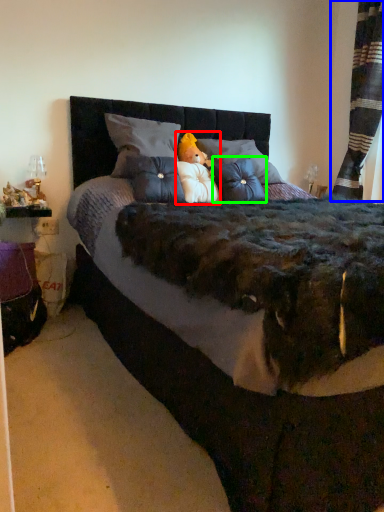
Question: Which object is the closest to the toy (highlighted by a red box)? Choose among these: curtain (highlighted by a blue box) or throw pillow (highlighted by a green box).

Choices:
 (A) curtain
 (B) throw pillow

Answer: (B)